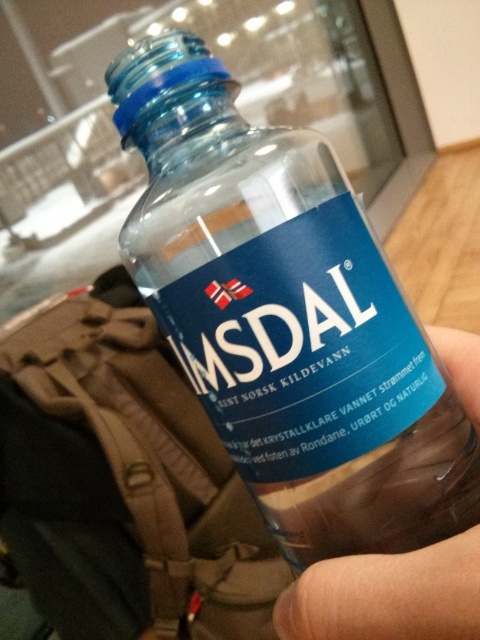
You are designing a display stand for the transparent glass bottle at center and the transparent plastic hand at lower right. The stand must accommodate both items. Considering their sizes, which item requires a larger base area on the display?

The transparent glass bottle at center requires a larger base area because it is bigger than the transparent plastic hand at lower right.

Looking at the image, where is the transparent glass bottle at center in relation to the transparent plastic hand at lower right?

The transparent glass bottle at center is to the left of the transparent plastic hand at lower right.